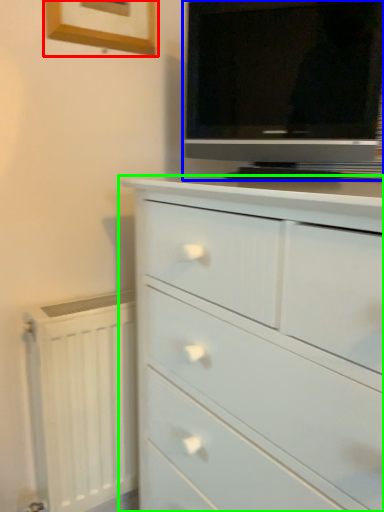
Question: Which object is positioned farthest from picture frame (highlighted by a red box)? Select from television (highlighted by a blue box) and chest of drawers (highlighted by a green box).

Choices:
 (A) television
 (B) chest of drawers

Answer: (B)